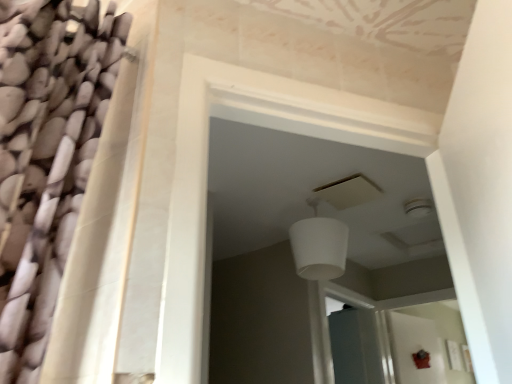
The image size is (512, 384). Describe the element at coordinates (319, 246) in the screenshot. I see `white matte lampshade at center` at that location.

Locate an element on the screen. The width and height of the screenshot is (512, 384). white matte lampshade at center is located at coordinates (319, 246).

Describe the element at coordinates (358, 346) in the screenshot. The image size is (512, 384). I see `transparent glass screen door at center` at that location.

The image size is (512, 384). Identify the location of transparent glass screen door at center. (358, 346).

Measure the distance between transparent glass screen door at center and camera.

transparent glass screen door at center and camera are 10.62 feet apart from each other.

This screenshot has height=384, width=512. What are the coordinates of `white matte lampshade at center` in the screenshot? It's located at (319, 246).

Considering the relative positions of white matte lampshade at center and transparent glass screen door at center in the image provided, is white matte lampshade at center to the left or to the right of transparent glass screen door at center?

Based on their positions, white matte lampshade at center is located to the left of transparent glass screen door at center.

Which object is further away from the camera taking this photo, white matte lampshade at center or transparent glass screen door at center?

transparent glass screen door at center is further from the camera.

Between point (339, 248) and point (375, 312), which one is positioned in front?

The point (339, 248) is closer.

From the image's perspective, between white matte lampshade at center and transparent glass screen door at center, who is located below?

transparent glass screen door at center, from the image's perspective.

From a real-world perspective, is white matte lampshade at center physically located above or below transparent glass screen door at center?

Clearly, from a real-world perspective, white matte lampshade at center is above transparent glass screen door at center.

Is white matte lampshade at center wider than transparent glass screen door at center?

Yes, white matte lampshade at center is wider than transparent glass screen door at center.

Does white matte lampshade at center have a greater height compared to transparent glass screen door at center?

No.

Does white matte lampshade at center have a smaller size compared to transparent glass screen door at center?

Correct, white matte lampshade at center occupies less space than transparent glass screen door at center.

Which is correct: white matte lampshade at center is inside transparent glass screen door at center, or outside of it?

white matte lampshade at center lies outside transparent glass screen door at center.

Consider the image. Is white matte lampshade at center in contact with transparent glass screen door at center?

They are not placed beside each other.

Is white matte lampshade at center facing towards transparent glass screen door at center?

No.

The width and height of the screenshot is (512, 384). I want to click on screen door below the white matte lampshade at center (from a real-world perspective), so click(x=358, y=346).

Considering the relative positions of transparent glass screen door at center and white matte lampshade at center in the image provided, is transparent glass screen door at center to the right of white matte lampshade at center from the viewer's perspective?

Yes.

Which object is further away from the camera, transparent glass screen door at center or white matte lampshade at center?

transparent glass screen door at center.

Between point (377, 327) and point (325, 222), which one is positioned behind?

The point (377, 327) is farther.

From the image's perspective, which is above, transparent glass screen door at center or white matte lampshade at center?

white matte lampshade at center appears higher in the image.

From a real-world perspective, between transparent glass screen door at center and white matte lampshade at center, who is vertically higher?

white matte lampshade at center is physically above.

Is transparent glass screen door at center thinner than white matte lampshade at center?

Indeed, transparent glass screen door at center has a lesser width compared to white matte lampshade at center.

Does transparent glass screen door at center have a greater height compared to white matte lampshade at center?

Indeed, transparent glass screen door at center has a greater height compared to white matte lampshade at center.

Is transparent glass screen door at center bigger or smaller than white matte lampshade at center?

In the image, transparent glass screen door at center appears to be larger than white matte lampshade at center.

Is transparent glass screen door at center completely or partially outside of white matte lampshade at center?

Absolutely, transparent glass screen door at center is external to white matte lampshade at center.

Is there a large distance between transparent glass screen door at center and white matte lampshade at center?

Absolutely, transparent glass screen door at center is distant from white matte lampshade at center.

Could you tell me if transparent glass screen door at center is turned towards white matte lampshade at center?

No.

This screenshot has height=384, width=512. I want to click on light fixture that is above the transparent glass screen door at center (from the image's perspective), so click(319, 246).

Locate an element on the screen. The width and height of the screenshot is (512, 384). screen door lying on the right of white matte lampshade at center is located at coordinates (358, 346).

Locate an element on the screen. The width and height of the screenshot is (512, 384). light fixture that appears above the transparent glass screen door at center (from the image's perspective) is located at coordinates (319, 246).